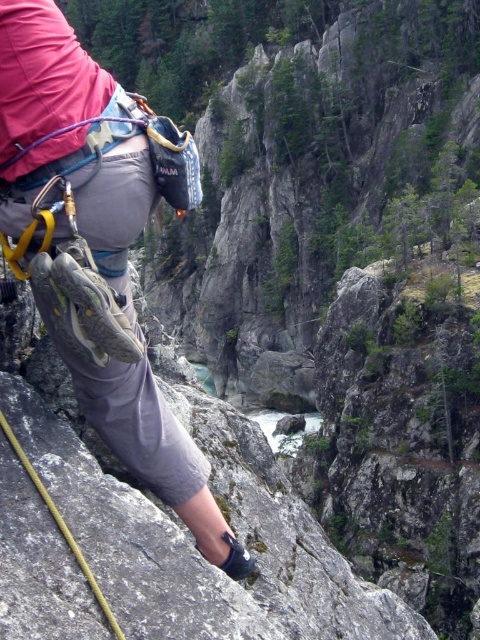
You are analyzing a rock climbing image and need to determine the position of the climber. Given that the climber is wearing a red jacket and gray shorts, where is the matte gray climbing shoe at center located in the image?

The matte gray climbing shoe at center is located at the center of the image, positioned at coordinates [99,244].

You are a rock climbing instructor assessing a climber. You notice the climber has a matte gray climbing shoe at center and a yellow nylon rope at lower left. Which object has a greater width?

The matte gray climbing shoe at center has a greater width than the yellow nylon rope at lower left.

You are a photographer trying to capture the climber in the image. You notice two points marked on the rock face at coordinates point (91, 298) and point (115, 627). Which point is closer to your camera lens?

Point (91, 298) is further to the camera than point (115, 627), so the closer point to your camera lens is point (115, 627).